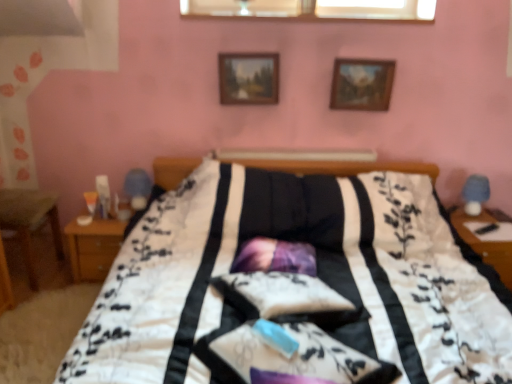
Question: Which direction should I rotate to look at wooden picture frame at upper center, arranged as the 1th picture frame when viewed from the right?

Choices:
 (A) right
 (B) left

Answer: (A)

Question: Does wooden nightstand at right come behind transparent glass window at upper center?

Choices:
 (A) yes
 (B) no

Answer: (B)

Question: From a real-world perspective, is wooden nightstand at right positioned under transparent glass window at upper center based on gravity?

Choices:
 (A) yes
 (B) no

Answer: (A)

Question: Is the depth of wooden nightstand at right less than that of transparent glass window at upper center?

Choices:
 (A) yes
 (B) no

Answer: (A)

Question: Can you confirm if wooden nightstand at right is shorter than transparent glass window at upper center?

Choices:
 (A) no
 (B) yes

Answer: (A)

Question: Considering the relative sizes of wooden nightstand at right and transparent glass window at upper center in the image provided, is wooden nightstand at right wider than transparent glass window at upper center?

Choices:
 (A) no
 (B) yes

Answer: (B)

Question: Are wooden nightstand at right and transparent glass window at upper center far apart?

Choices:
 (A) no
 (B) yes

Answer: (B)

Question: Is blue fabric table lamp at right wider than wooden nightstand at left?

Choices:
 (A) yes
 (B) no

Answer: (B)

Question: Is blue fabric table lamp at right thinner than wooden nightstand at left?

Choices:
 (A) no
 (B) yes

Answer: (B)

Question: From a real-world perspective, is blue fabric table lamp at right on top of wooden nightstand at left?

Choices:
 (A) yes
 (B) no

Answer: (A)

Question: Does blue fabric table lamp at right appear on the right side of wooden nightstand at left?

Choices:
 (A) yes
 (B) no

Answer: (A)

Question: Is blue fabric table lamp at right not near wooden nightstand at left?

Choices:
 (A) yes
 (B) no

Answer: (A)

Question: Is blue fabric table lamp at right further to the viewer compared to wooden nightstand at left?

Choices:
 (A) yes
 (B) no

Answer: (A)

Question: Is transparent glass window at upper center wider than purple satin pillow at center?

Choices:
 (A) yes
 (B) no

Answer: (B)